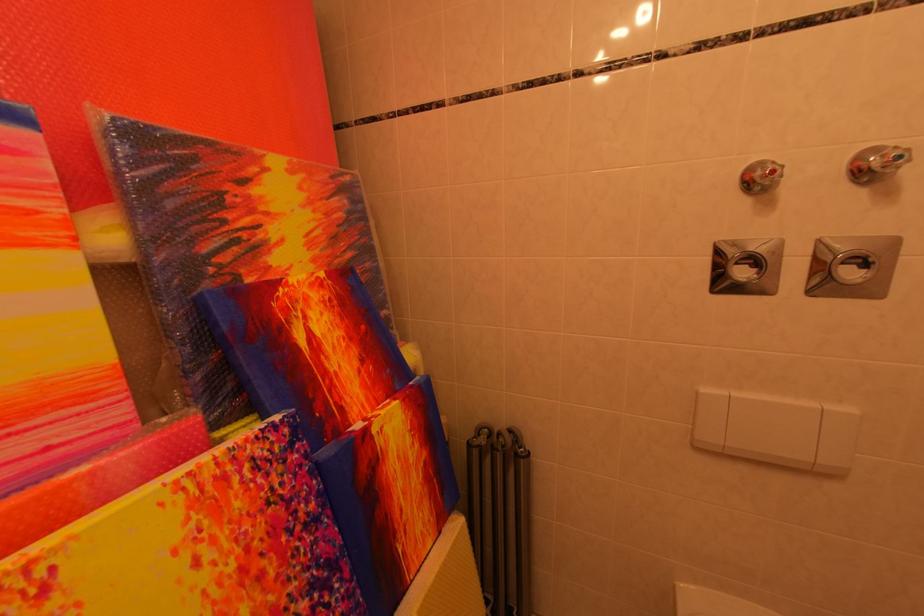
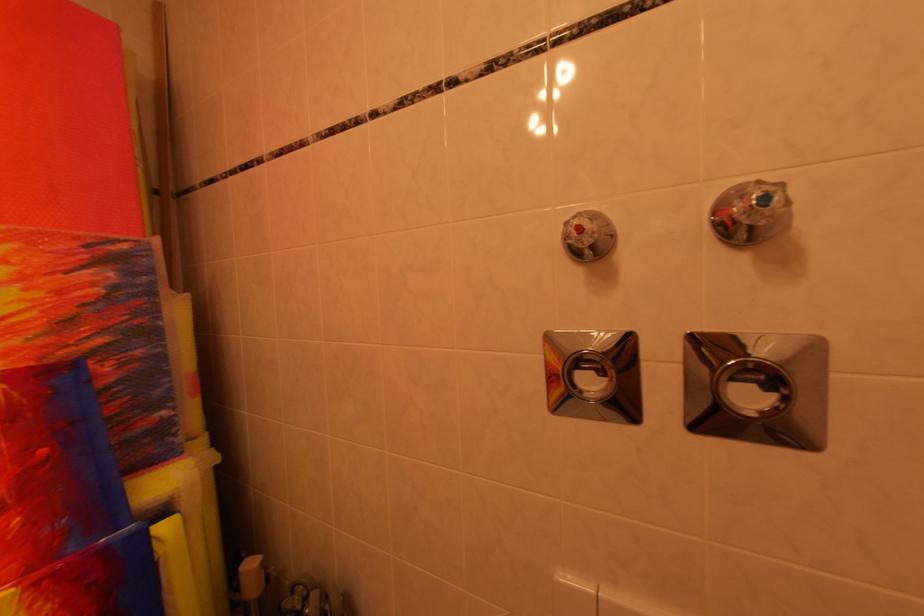
Question: How did the camera likely rotate?

Choices:
 (A) Left
 (B) Right
 (C) Up
 (D) Down

Answer: (C)